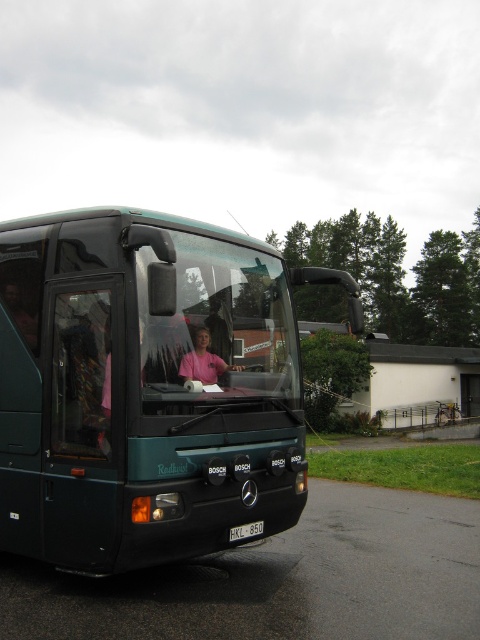
Between metallic green bus at center and black plastic license plate at center, which one appears on the left side from the viewer's perspective?

metallic green bus at center

Measure the distance from metallic green bus at center to black plastic license plate at center.

metallic green bus at center and black plastic license plate at center are 24.58 inches apart.

Is point (180, 310) less distant than point (232, 540)?

Yes, point (180, 310) is in front of point (232, 540).

Locate an element on the screen. metallic green bus at center is located at coordinates (145, 387).

Does pink matte shirt at center come behind black plastic license plate at center?

No, pink matte shirt at center is closer to the viewer.

Between pink matte shirt at center and black plastic license plate at center, which one appears on the right side from the viewer's perspective?

black plastic license plate at center is more to the right.

You are a GUI agent. You are given a task and a screenshot of the screen. Output one action in this format:
    pyautogui.click(x=<x>, y=<y>)
    Task: Click on the pink matte shirt at center
    
    Given the screenshot: What is the action you would take?
    pyautogui.click(x=204, y=360)

Locate an element on the screen. The width and height of the screenshot is (480, 640). pink matte shirt at center is located at coordinates (204, 360).

Is metallic green bus at center wider than pink matte shirt at center?

Yes, metallic green bus at center is wider than pink matte shirt at center.

Who is more distant from viewer, (x=55, y=509) or (x=242, y=369)?

The point (x=242, y=369) is more distant.

Identify the location of metallic green bus at center. (145, 387).